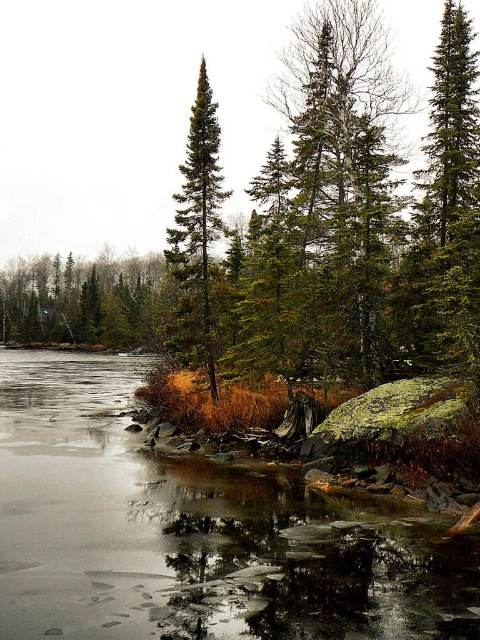
Can you confirm if green matte evergreen tree at upper right is taller than green matte tree at upper left?

Yes, green matte evergreen tree at upper right is taller than green matte tree at upper left.

Is point (456, 70) less distant than point (48, 310)?

That is True.

What do you see at coordinates (452, 195) in the screenshot?
I see `green matte evergreen tree at upper right` at bounding box center [452, 195].

Find the location of a particular element. The width and height of the screenshot is (480, 640). green matte evergreen tree at upper right is located at coordinates (452, 195).

Who is positioned more to the right, smooth ice at lower left or green matte tree at upper left?

Positioned to the right is smooth ice at lower left.

The image size is (480, 640). I want to click on smooth ice at lower left, so click(x=191, y=532).

Who is more forward, (60,534) or (214,365)?

Point (60,534) is more forward.

Which is behind, point (168, 554) or point (204, 352)?

The point (204, 352) is more distant.

Is point (12, 600) positioned behind point (178, 269)?

No.

At what (x,y) coordinates should I click in order to perform the action: click on smooth ice at lower left. Please return your answer as a coordinate pair (x, y). Looking at the image, I should click on (191, 532).